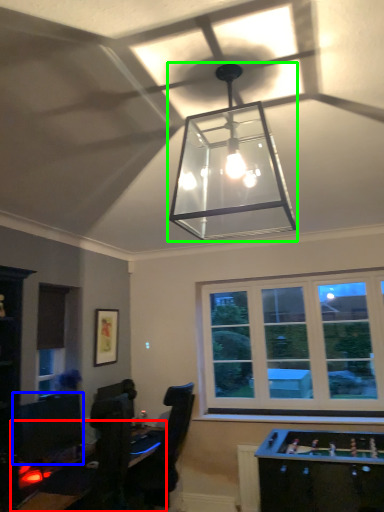
Question: Based on their relative distances, which object is farther from table (highlighted by a red box)? Choose from computer monitor (highlighted by a blue box) and lamp (highlighted by a green box).

Choices:
 (A) computer monitor
 (B) lamp

Answer: (B)